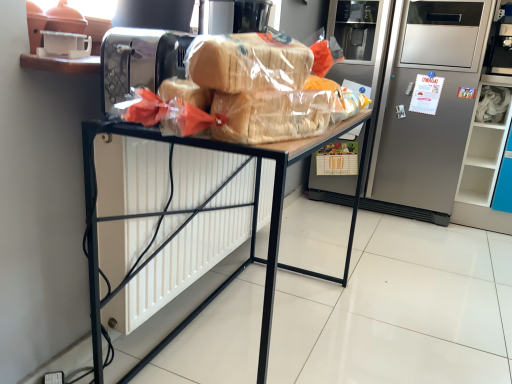
Question: Considering the relative sizes of translucent plastic bread at center and wooden desk at center in the image provided, is translucent plastic bread at center wider than wooden desk at center?

Choices:
 (A) yes
 (B) no

Answer: (B)

Question: Is translucent plastic bread at center positioned with its back to wooden desk at center?

Choices:
 (A) no
 (B) yes

Answer: (A)

Question: From a real-world perspective, is translucent plastic bread at center positioned over wooden desk at center based on gravity?

Choices:
 (A) yes
 (B) no

Answer: (A)

Question: Considering the relative sizes of translucent plastic bread at center and wooden desk at center in the image provided, is translucent plastic bread at center shorter than wooden desk at center?

Choices:
 (A) no
 (B) yes

Answer: (B)

Question: Is translucent plastic bread at center closer to the viewer compared to wooden desk at center?

Choices:
 (A) yes
 (B) no

Answer: (A)

Question: Is translucent plastic bread at center located outside wooden desk at center?

Choices:
 (A) yes
 (B) no

Answer: (A)

Question: Considering the relative sizes of wooden desk at center and translucent plastic bread at center in the image provided, is wooden desk at center smaller than translucent plastic bread at center?

Choices:
 (A) no
 (B) yes

Answer: (A)

Question: Is translucent plastic bread at center surrounded by wooden desk at center?

Choices:
 (A) no
 (B) yes

Answer: (A)

Question: Can you confirm if wooden desk at center is thinner than translucent plastic bread at center?

Choices:
 (A) yes
 (B) no

Answer: (B)

Question: Is wooden desk at center not close to translucent plastic bread at center?

Choices:
 (A) no
 (B) yes

Answer: (A)

Question: Does wooden desk at center have a larger size compared to translucent plastic bread at center?

Choices:
 (A) no
 (B) yes

Answer: (B)

Question: Can you confirm if wooden desk at center is taller than translucent plastic bread at center?

Choices:
 (A) no
 (B) yes

Answer: (B)

Question: Does satin silver refrigerator at center have a larger size compared to wooden desk at center?

Choices:
 (A) yes
 (B) no

Answer: (A)